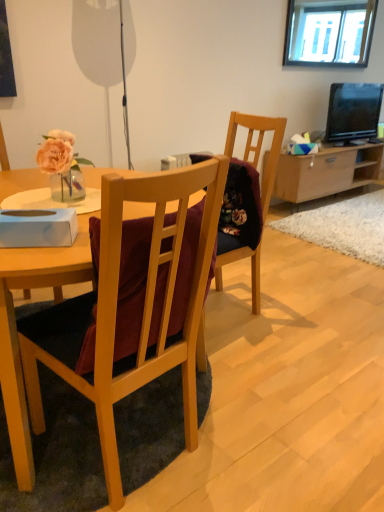
Where is `free spot below wooden chair at center (from a real-world perspective)`? This screenshot has width=384, height=512. free spot below wooden chair at center (from a real-world perspective) is located at coordinates (228, 305).